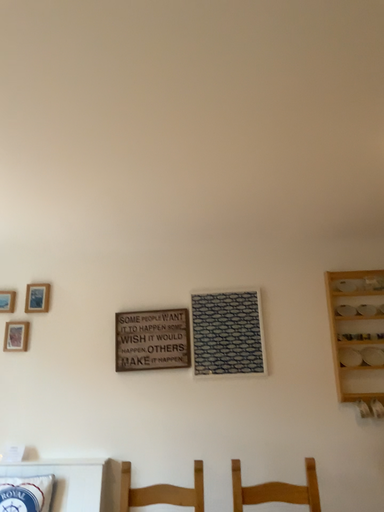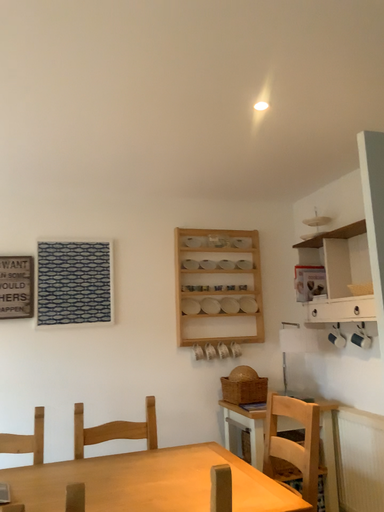
Question: Which way did the camera rotate in the video?

Choices:
 (A) rotated left
 (B) rotated right

Answer: (B)